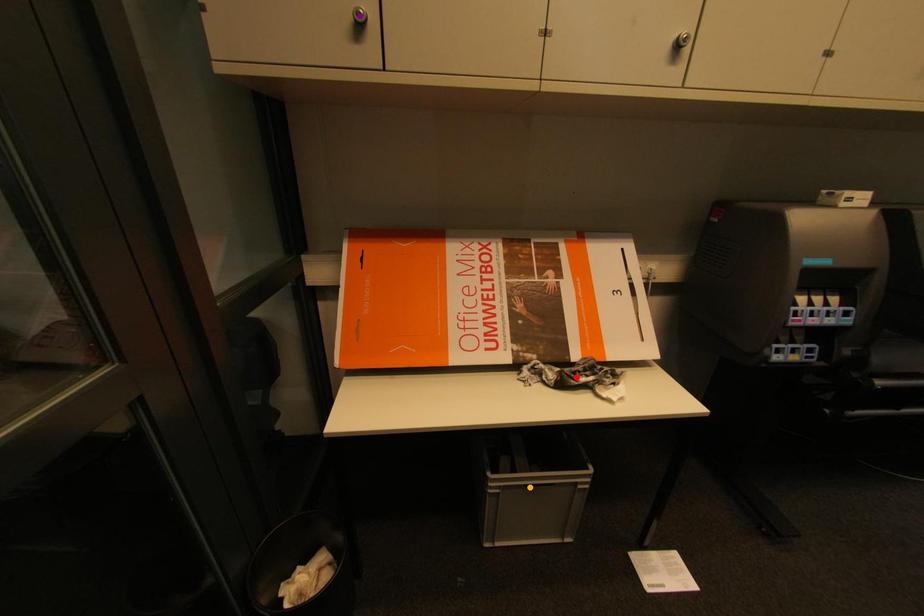
Order these from nearest to farthest:
orange point | purple point | red point

purple point, red point, orange point